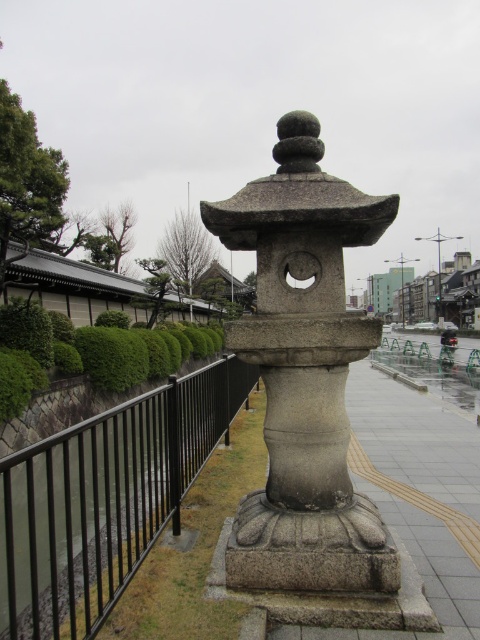
You are standing on the pathway and want to walk from the point closer to you to the point farther away. Which path should you take between point (229,228) and point (6,458)?

You should walk towards point (6,458) because point (229,228) is closer to you, and point (6,458) is farther away.

You are a gardener who needs to water both the gray stone lantern at center and the green bushy hedge at left. Given that your watering can has a capacity of 10 liters and each plant requires 2 liters of water, how many trips do you need to make between the water source and the plants if you start at the water source and must water both plants?

The gray stone lantern at center and green bushy hedge at left are 8.02 meters apart from each other. Since the distance between them is 8.02 meters, you would need to make two trips to water both plants, as each trip allows you to water one plant and return to the source before moving to the next one.

You are walking along the pathway and notice the black metal fence at left and the green bushy hedge at left. Which one is positioned more to the right side from your perspective?

The black metal fence at left is positioned to the right of the green bushy hedge at left, so it is more to the right side.